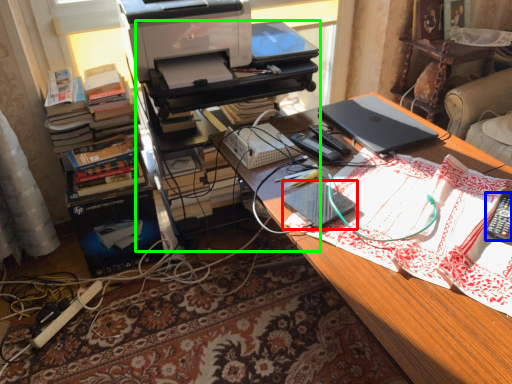
Question: Which object is the closest to the notebook (highlighted by a red box)? Choose among these: remote control (highlighted by a blue box) or computer desk (highlighted by a green box).

Choices:
 (A) remote control
 (B) computer desk

Answer: (A)